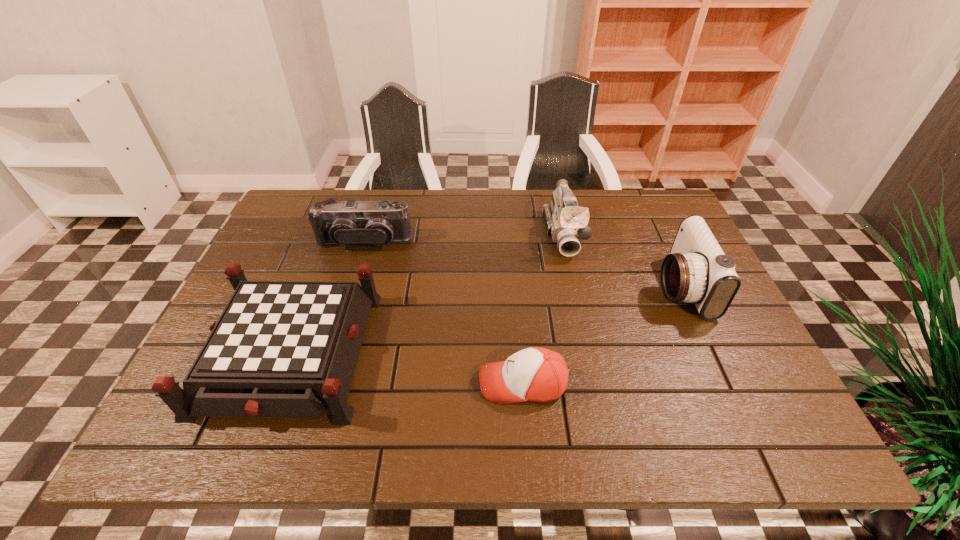
At what (x,y) coordinates should I click in order to perform the action: click on object at the far left corner. Please return your answer as a coordinate pair (x, y). Looking at the image, I should click on (349, 222).

What are the coordinates of `object that is positioned at the near left corner` in the screenshot? It's located at (280, 348).

This screenshot has width=960, height=540. I want to click on vacant region at the far edge of the desktop, so click(470, 236).

At what (x,y) coordinates should I click in order to perform the action: click on free spot at the near edge of the desktop. Please return your answer as a coordinate pair (x, y). The width and height of the screenshot is (960, 540). Looking at the image, I should click on (383, 441).

Where is `free space at the left edge of the desktop`? free space at the left edge of the desktop is located at coordinates (284, 255).

Where is `empty location between the rightmost object and the fourth object from left to right`? The image size is (960, 540). empty location between the rightmost object and the fourth object from left to right is located at coordinates (622, 260).

Locate an element on the screen. The width and height of the screenshot is (960, 540). free space that is in between the shortest camcorder and the baseball cap is located at coordinates (444, 312).

Image resolution: width=960 pixels, height=540 pixels. What are the coordinates of `blank region between the leftmost camcorder and the baseball cap` in the screenshot? It's located at (444, 312).

Where is `unoccupied position between the leftmost camcorder and the rightmost camcorder`? unoccupied position between the leftmost camcorder and the rightmost camcorder is located at coordinates (522, 264).

Where is `unoccupied position between the rightmost object and the checkerboard`? The height and width of the screenshot is (540, 960). unoccupied position between the rightmost object and the checkerboard is located at coordinates (485, 320).